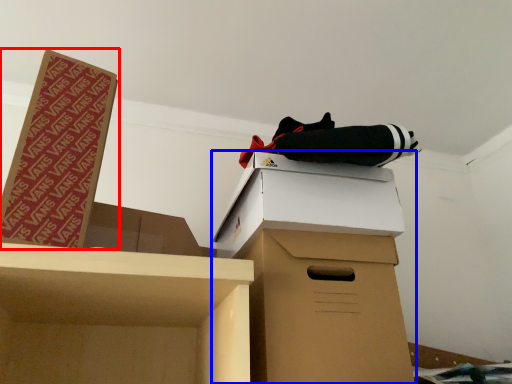
Question: Which object appears closest to the camera in this image, box (highlighted by a red box) or cardboard box (highlighted by a blue box)?

Choices:
 (A) box
 (B) cardboard box

Answer: (A)